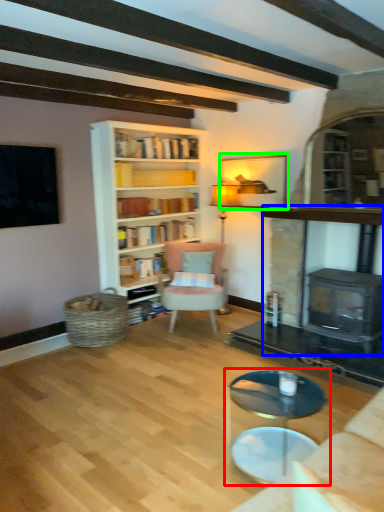
Question: Considering the real-world distances, which object is farthest from coffee table (highlighted by a red box)? fireplace (highlighted by a blue box) or picture frame (highlighted by a green box)?

Choices:
 (A) fireplace
 (B) picture frame

Answer: (B)